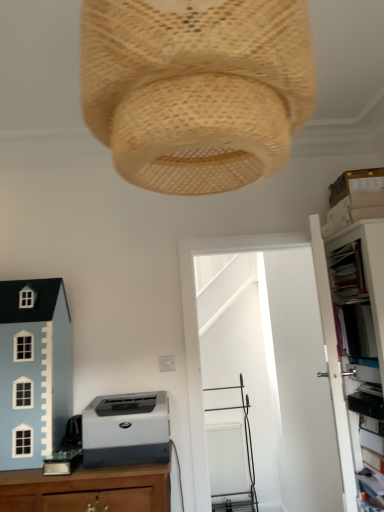
The image size is (384, 512). Describe the element at coordinates (333, 366) in the screenshot. I see `white plastic file cabinet at right` at that location.

Measure the distance between gray matte printer at lower left and camera.

→ gray matte printer at lower left is 5.77 feet from camera.

Locate an element on the screen. The image size is (384, 512). woven beige lampshade at upper center is located at coordinates (196, 89).

Image resolution: width=384 pixels, height=512 pixels. What do you see at coordinates (196, 89) in the screenshot?
I see `woven beige lampshade at upper center` at bounding box center [196, 89].

This screenshot has height=512, width=384. I want to click on white plastic file cabinet at right, so click(333, 366).

How many degrees apart are the facing directions of white plastic file cabinet at right and woven beige lampshade at upper center?

90.3 degrees separate the facing orientations of white plastic file cabinet at right and woven beige lampshade at upper center.

Does white plastic file cabinet at right have a larger size compared to woven beige lampshade at upper center?

Yes, white plastic file cabinet at right is bigger than woven beige lampshade at upper center.

Is white plastic file cabinet at right closer to the viewer compared to woven beige lampshade at upper center?

No, the depth of white plastic file cabinet at right is greater than that of woven beige lampshade at upper center.

Identify the location of file cabinet below the woven beige lampshade at upper center (from the image's perspective). (333, 366).

Consider the image. Who is bigger, white plastic file cabinet at right or gray matte printer at lower left?

With larger size is white plastic file cabinet at right.

From the image's perspective, which is above, white plastic file cabinet at right or gray matte printer at lower left?

white plastic file cabinet at right, from the image's perspective.

Is white plastic file cabinet at right looking in the opposite direction of gray matte printer at lower left?

No, gray matte printer at lower left is not at the back of white plastic file cabinet at right.

Which is more to the left, white plastic file cabinet at right or gray matte printer at lower left?

gray matte printer at lower left is more to the left.

From the image's perspective, which is below, white plastic file cabinet at right or light blue painted wood toy house at lower left?

white plastic file cabinet at right is shown below in the image.

Who is smaller, white plastic file cabinet at right or light blue painted wood toy house at lower left?

light blue painted wood toy house at lower left.

Can you confirm if white plastic file cabinet at right is positioned to the right of light blue painted wood toy house at lower left?

Yes.

Is white plastic file cabinet at right wider or thinner than light blue painted wood toy house at lower left?

In the image, white plastic file cabinet at right appears to be more narrow than light blue painted wood toy house at lower left.

Considering the sizes of objects light blue painted wood toy house at lower left and woven beige lampshade at upper center in the image provided, who is smaller, light blue painted wood toy house at lower left or woven beige lampshade at upper center?

light blue painted wood toy house at lower left is smaller.

Can you confirm if light blue painted wood toy house at lower left is positioned to the right of woven beige lampshade at upper center?

In fact, light blue painted wood toy house at lower left is to the left of woven beige lampshade at upper center.

From the image's perspective, is light blue painted wood toy house at lower left above woven beige lampshade at upper center?

No, from the image's perspective, light blue painted wood toy house at lower left is not above woven beige lampshade at upper center.

Does gray matte printer at lower left have a larger size compared to white plastic file cabinet at right?

Actually, gray matte printer at lower left might be smaller than white plastic file cabinet at right.

Consider the image. Is gray matte printer at lower left looking in the opposite direction of white plastic file cabinet at right?

No, gray matte printer at lower left is not facing the opposite direction of white plastic file cabinet at right.

Looking at this image, from the image's perspective, is gray matte printer at lower left on top of white plastic file cabinet at right?

No, from the image's perspective, gray matte printer at lower left is not over white plastic file cabinet at right.

Image resolution: width=384 pixels, height=512 pixels. Identify the location of printer below the white plastic file cabinet at right (from a real-world perspective). (126, 430).

Which object is closer to the camera taking this photo, light blue painted wood toy house at lower left or white plastic file cabinet at right?

white plastic file cabinet at right is in front.

The image size is (384, 512). In order to click on toy above the white plastic file cabinet at right (from the image's perspective) in this screenshot , I will do `click(34, 371)`.

How much distance is there between light blue painted wood toy house at lower left and white plastic file cabinet at right?

light blue painted wood toy house at lower left and white plastic file cabinet at right are 2.25 meters apart from each other.

Considering the positions of objects woven beige lampshade at upper center and light blue painted wood toy house at lower left in the image provided, who is more to the right, woven beige lampshade at upper center or light blue painted wood toy house at lower left?

woven beige lampshade at upper center is more to the right.

Locate an element on the screen. toy beneath the woven beige lampshade at upper center (from a real-world perspective) is located at coordinates (34, 371).

Who is shorter, woven beige lampshade at upper center or light blue painted wood toy house at lower left?

woven beige lampshade at upper center is shorter.

Considering the relative sizes of woven beige lampshade at upper center and light blue painted wood toy house at lower left in the image provided, is woven beige lampshade at upper center bigger than light blue painted wood toy house at lower left?

Yes.

Where is `lamp that appears above the white plastic file cabinet at right (from the image's perspective)`? The height and width of the screenshot is (512, 384). lamp that appears above the white plastic file cabinet at right (from the image's perspective) is located at coordinates (196, 89).

Identify the location of printer that is below the white plastic file cabinet at right (from the image's perspective). The image size is (384, 512). pos(126,430).

Looking at the image, which one is located closer to gray matte printer at lower left, light blue painted wood toy house at lower left or white plastic file cabinet at right?

Among the two, light blue painted wood toy house at lower left is located nearer to gray matte printer at lower left.

Which object lies nearer to the anchor point white plastic file cabinet at right, light blue painted wood toy house at lower left or gray matte printer at lower left?

Among the two, gray matte printer at lower left is located nearer to white plastic file cabinet at right.

Which object lies further to the anchor point white plastic file cabinet at right, woven beige lampshade at upper center or light blue painted wood toy house at lower left?

woven beige lampshade at upper center is positioned further to the anchor white plastic file cabinet at right.

Which object lies nearer to the anchor point light blue painted wood toy house at lower left, gray matte printer at lower left or woven beige lampshade at upper center?

gray matte printer at lower left is closer to light blue painted wood toy house at lower left.

When comparing their distances from white plastic file cabinet at right, does gray matte printer at lower left or woven beige lampshade at upper center seem further?

The object further to white plastic file cabinet at right is woven beige lampshade at upper center.

Looking at the image, which one is located closer to white plastic file cabinet at right, gray matte printer at lower left or light blue painted wood toy house at lower left?

Based on the image, gray matte printer at lower left appears to be nearer to white plastic file cabinet at right.

Estimate the real-world distances between objects in this image. Which object is closer to woven beige lampshade at upper center, light blue painted wood toy house at lower left or gray matte printer at lower left?

The object closer to woven beige lampshade at upper center is gray matte printer at lower left.

From the image, which object appears to be nearer to gray matte printer at lower left, white plastic file cabinet at right or light blue painted wood toy house at lower left?

light blue painted wood toy house at lower left is positioned closer to the anchor gray matte printer at lower left.

This screenshot has width=384, height=512. In order to click on printer between light blue painted wood toy house at lower left and white plastic file cabinet at right in this screenshot , I will do `click(126, 430)`.

Locate an element on the screen. toy that lies between woven beige lampshade at upper center and gray matte printer at lower left from top to bottom is located at coordinates (34, 371).

Where is `file cabinet between woven beige lampshade at upper center and gray matte printer at lower left in the up-down direction`? file cabinet between woven beige lampshade at upper center and gray matte printer at lower left in the up-down direction is located at coordinates (333, 366).

You are a GUI agent. You are given a task and a screenshot of the screen. Output one action in this format:
    pyautogui.click(x=<x>, y=<y>)
    Task: Click on the lamp between light blue painted wood toy house at lower left and white plastic file cabinet at right in the horizontal direction
    
    Given the screenshot: What is the action you would take?
    pyautogui.click(x=196, y=89)